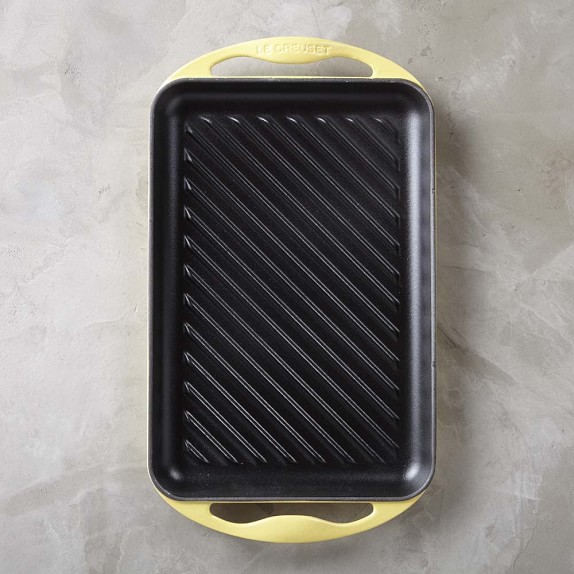
Identify the location of plate. (358, 433).